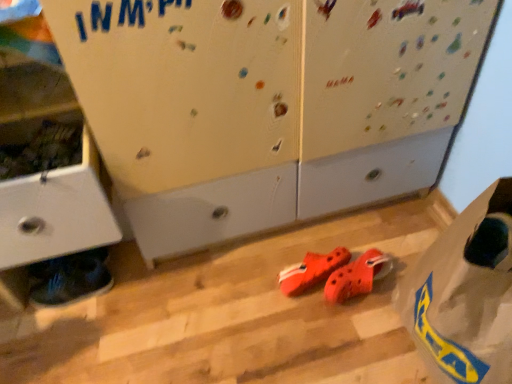
Locate an element on the screen. The image size is (512, 384). free spot to the right of matte white cabinet at left is located at coordinates (190, 288).